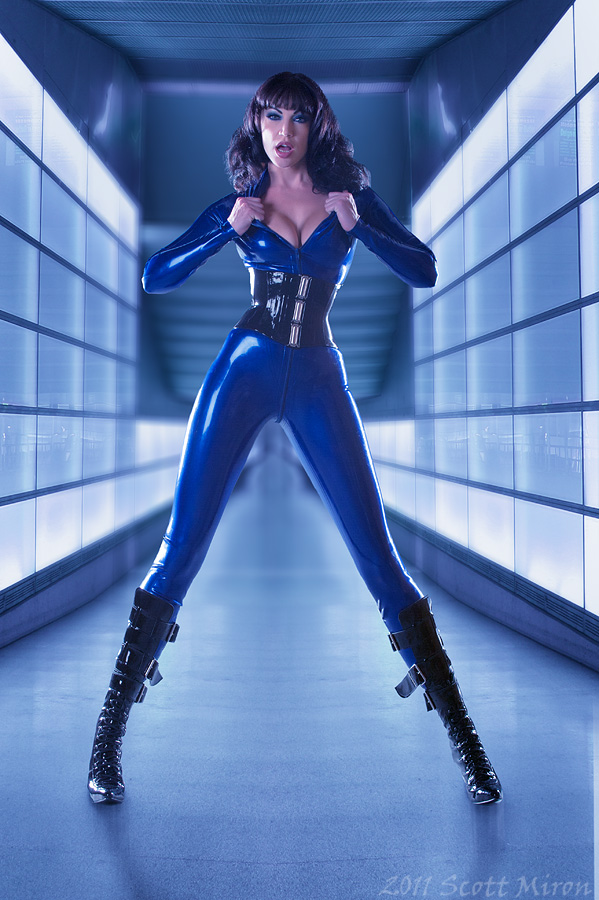
The height and width of the screenshot is (900, 599). I want to click on ceiling, so click(320, 30).